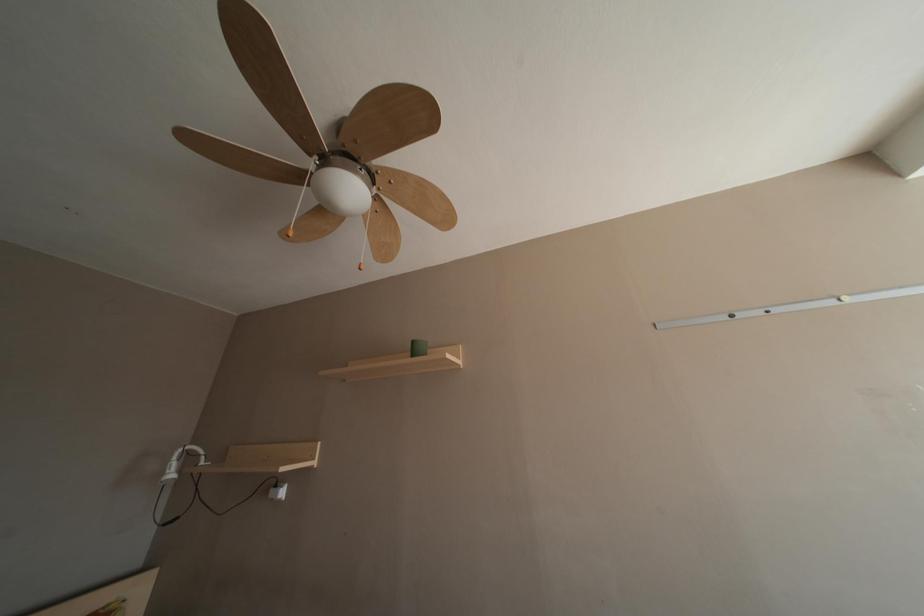
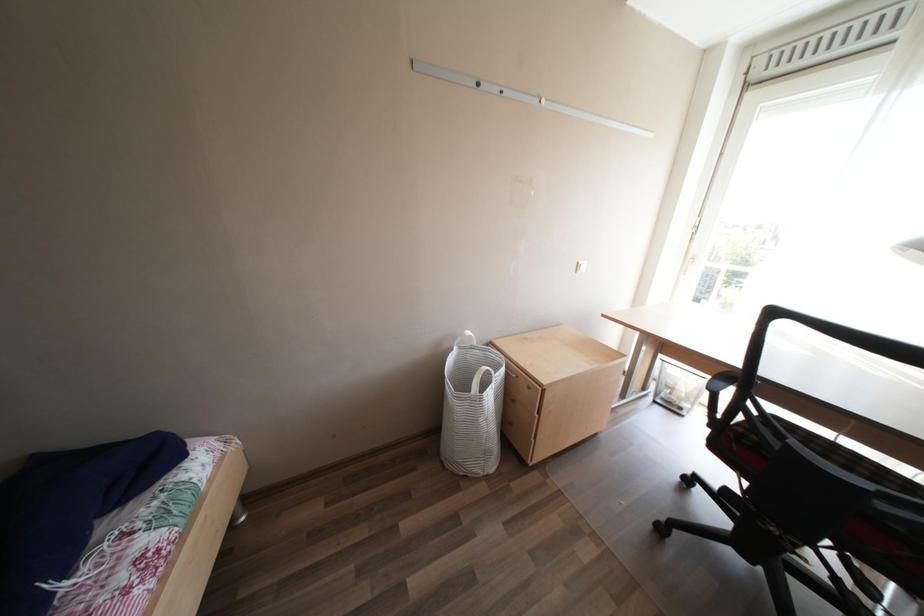
Consider the image. The first image is from the beginning of the video and the second image is from the end. How did the camera likely rotate when shooting the video?

The camera's rotation is toward right-down.